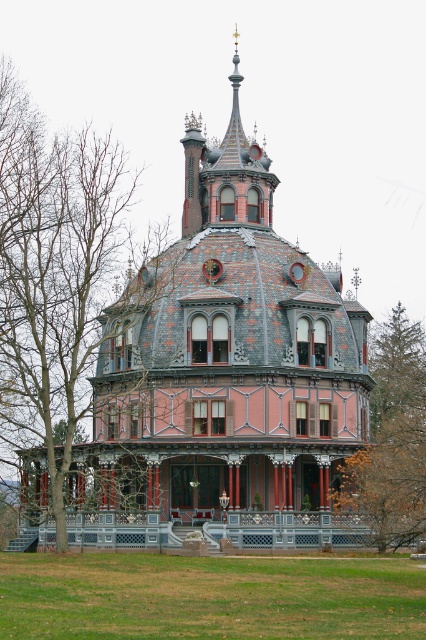
Does brown leafless tree at left have a larger size compared to brown wood tree at right?

Yes, brown leafless tree at left is bigger than brown wood tree at right.

Image resolution: width=426 pixels, height=640 pixels. What do you see at coordinates (52, 278) in the screenshot? I see `brown leafless tree at left` at bounding box center [52, 278].

I want to click on brown leafless tree at left, so click(x=52, y=278).